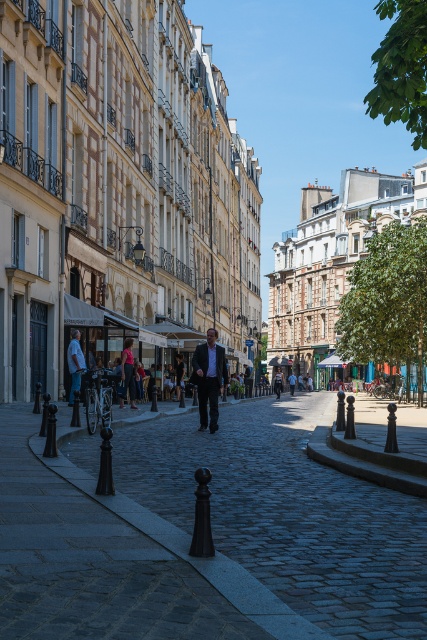
Question: In this image, where is light brown leather jacket at center located relative to denim jacket at center?

Choices:
 (A) above
 (B) below

Answer: (A)

Question: Which object appears closest to the camera in this image?

Choices:
 (A) smooth cobblestone street at center
 (B) light brown leather jacket at center
 (C) light blue shirt at left
 (D) light blue jeans at center

Answer: (A)

Question: Is denim jacket at center bigger than light blue jeans at center?

Choices:
 (A) no
 (B) yes

Answer: (B)

Question: Among these points, which one is nearest to the camera?

Choices:
 (A) (205, 416)
 (B) (292, 376)
 (C) (72, 365)
 (D) (280, 371)

Answer: (A)

Question: Is dark gray suit at center bigger than denim jacket at center?

Choices:
 (A) yes
 (B) no

Answer: (B)

Question: Which point appears farthest from the camera in this image?

Choices:
 (A) (281, 388)
 (B) (125, 376)

Answer: (A)